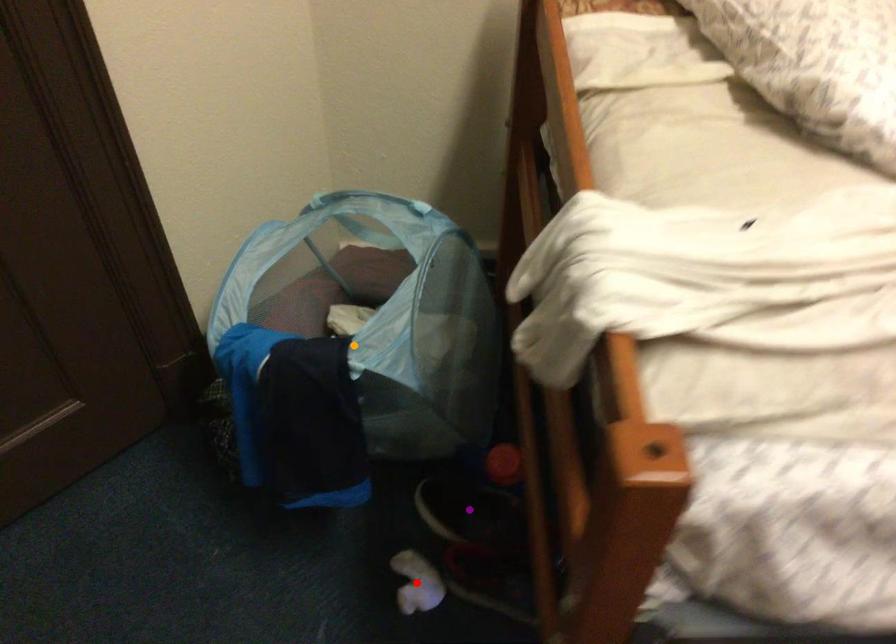
Order these from nearest to farthest:
purple point
orange point
red point

purple point, red point, orange point